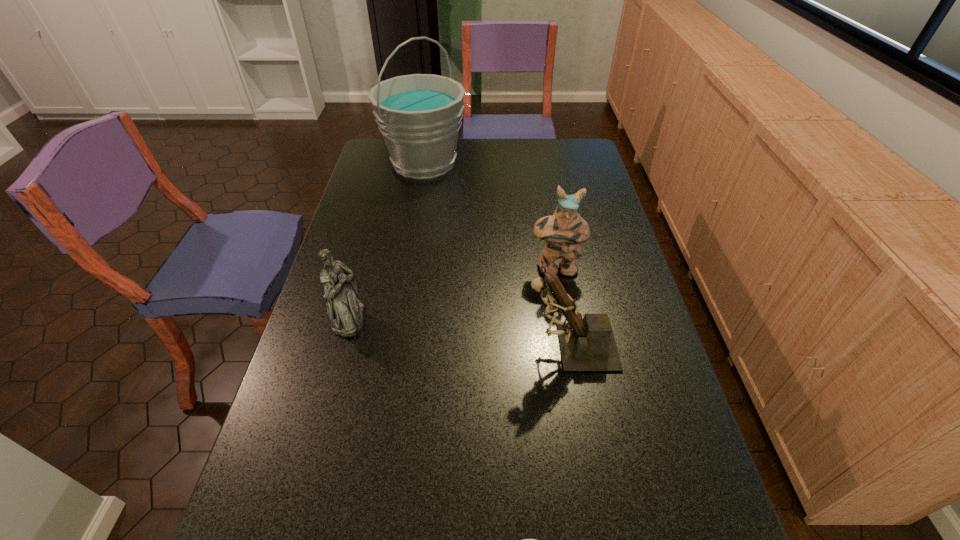
Identify the location of figurine located at the left edge. The width and height of the screenshot is (960, 540). pyautogui.click(x=344, y=309).

What are the coordinates of `object that is at the far left corner` in the screenshot? It's located at (419, 116).

Identify the location of free space at the far edge. The height and width of the screenshot is (540, 960). (511, 159).

This screenshot has width=960, height=540. In the image, there is a desktop. In order to click on vacant space at the left edge in this screenshot , I will do `click(291, 394)`.

Where is `vacant space at the right edge`? vacant space at the right edge is located at coordinates (597, 176).

Image resolution: width=960 pixels, height=540 pixels. In the image, there is a desktop. Find the location of `vacant space at the far right corner`. vacant space at the far right corner is located at coordinates (595, 164).

Where is `vacant space in between the fourth nearest object and the farthest object`? The width and height of the screenshot is (960, 540). vacant space in between the fourth nearest object and the farthest object is located at coordinates (490, 216).

Find the location of `empty location between the farthest figurine and the tallest object`. empty location between the farthest figurine and the tallest object is located at coordinates (490, 216).

Identify which object is located as the second nearest to the second farthest object. Please provide its 2D coordinates. Your answer should be formatted as a tuple, i.e. [(x, y)], where the tuple contains the x and y coordinates of a point satisfying the conditions above.

[(419, 116)]

What are the coordinates of `object that stands as the fourth closest to the nearest object` in the screenshot? It's located at (419, 116).